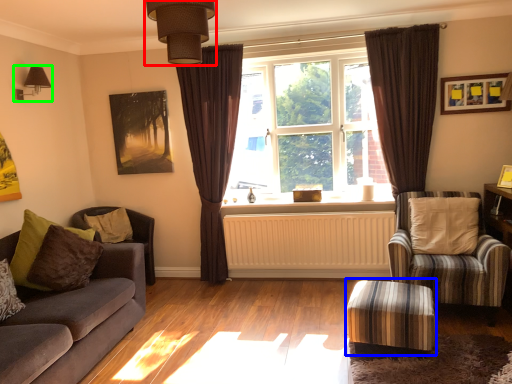
Question: Based on their relative distances, which object is farther from light fixture (highlighted by a red box)? Choose from stool (highlighted by a blue box) and light fixture (highlighted by a green box).

Choices:
 (A) stool
 (B) light fixture

Answer: (B)